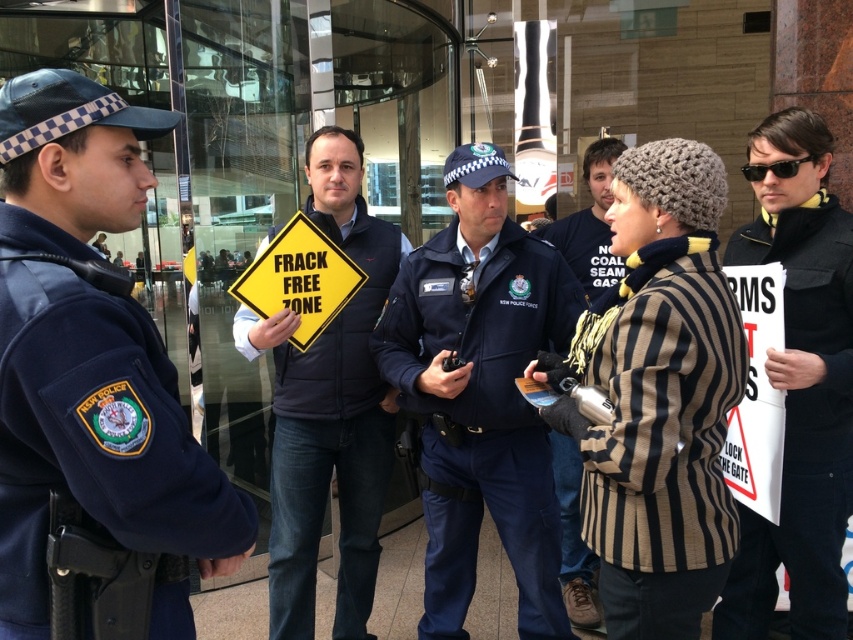
Is navy blue uniform at left positioned at the back of dark blue uniform at center?

No, navy blue uniform at left is in front of dark blue uniform at center.

Is navy blue uniform at left bigger than dark blue uniform at center?

Incorrect, navy blue uniform at left is not larger than dark blue uniform at center.

Locate an element on the screen. This screenshot has height=640, width=853. navy blue uniform at left is located at coordinates (91, 388).

Describe the element at coordinates (329, 408) in the screenshot. I see `yellow diamond sign at center` at that location.

Which is more to the right, yellow diamond sign at center or striped woolen sweater at center?

striped woolen sweater at center

At what (x,y) coordinates should I click in order to perform the action: click on yellow diamond sign at center. Please return your answer as a coordinate pair (x, y). Looking at the image, I should click on (329, 408).

In the scene shown: Is dark blue uniform at center below white paper sign at right?

Yes, dark blue uniform at center is below white paper sign at right.

This screenshot has height=640, width=853. What are the coordinates of `dark blue uniform at center` in the screenshot? It's located at (480, 394).

Find the location of a particular element. Image resolution: width=853 pixels, height=640 pixels. dark blue uniform at center is located at coordinates (480, 394).